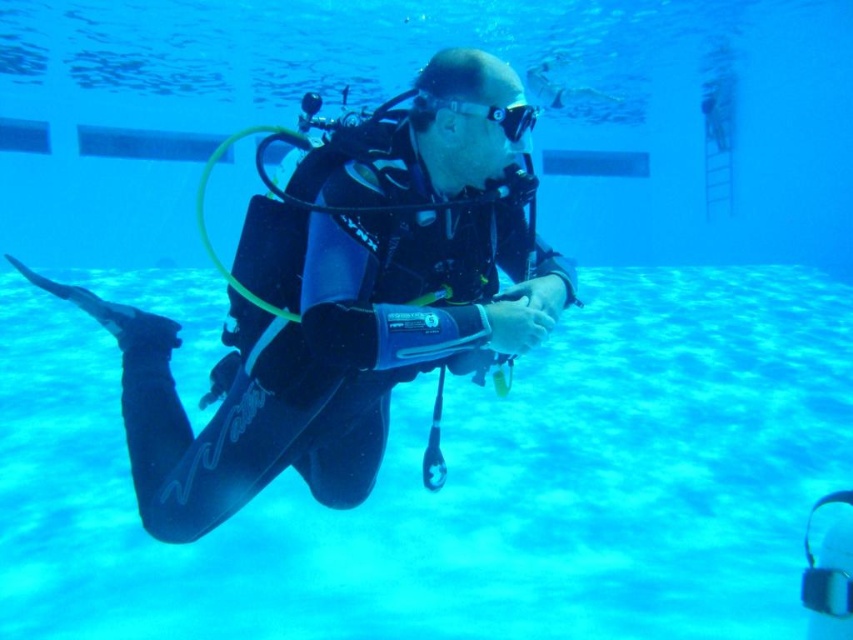
This screenshot has height=640, width=853. What are the coordinates of `blue matte swimming pool at center` in the screenshot? It's located at (465, 483).

Does blue matte swimming pool at center appear on the right side of transparent rubber goggles at center?

Yes, blue matte swimming pool at center is to the right of transparent rubber goggles at center.

Does point (824, 438) come closer to viewer compared to point (531, 122)?

No, (824, 438) is further to viewer.

Image resolution: width=853 pixels, height=640 pixels. I want to click on blue matte swimming pool at center, so [x=465, y=483].

Can you confirm if black matte scuba diver at center is shorter than transparent rubber goggles at center?

In fact, black matte scuba diver at center may be taller than transparent rubber goggles at center.

Does black matte scuba diver at center appear on the right side of transparent rubber goggles at center?

Incorrect, black matte scuba diver at center is not on the right side of transparent rubber goggles at center.

Measure the distance between point [364,163] and camera.

A distance of 5.84 feet exists between point [364,163] and camera.

Locate an element on the screen. The image size is (853, 640). black matte scuba diver at center is located at coordinates (344, 305).

Can you confirm if blue matte swimming pool at center is positioned above black matte scuba diver at center?

Actually, blue matte swimming pool at center is below black matte scuba diver at center.

Between blue matte swimming pool at center and black matte scuba diver at center, which one appears on the left side from the viewer's perspective?

Positioned to the left is black matte scuba diver at center.

Find the location of a particular element. The image size is (853, 640). blue matte swimming pool at center is located at coordinates (465, 483).